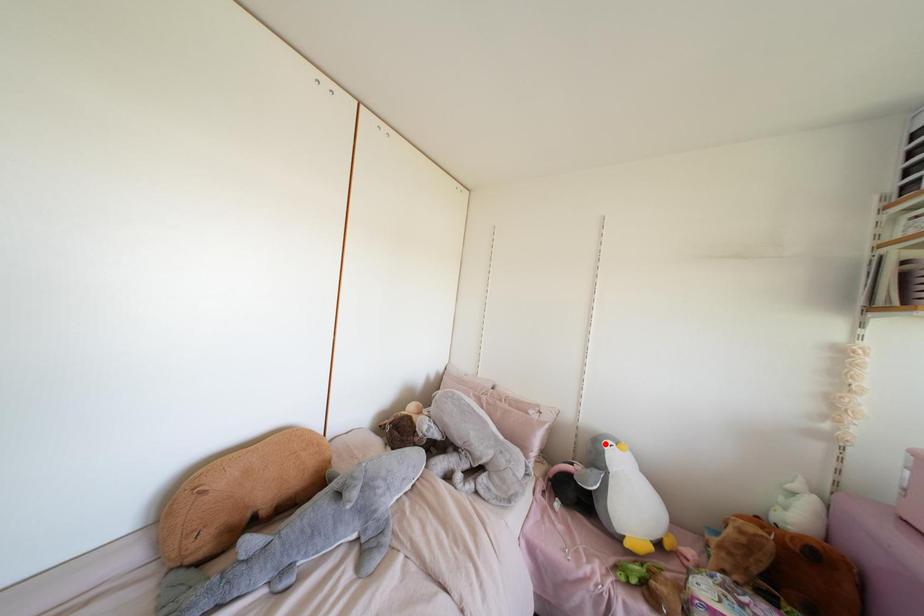
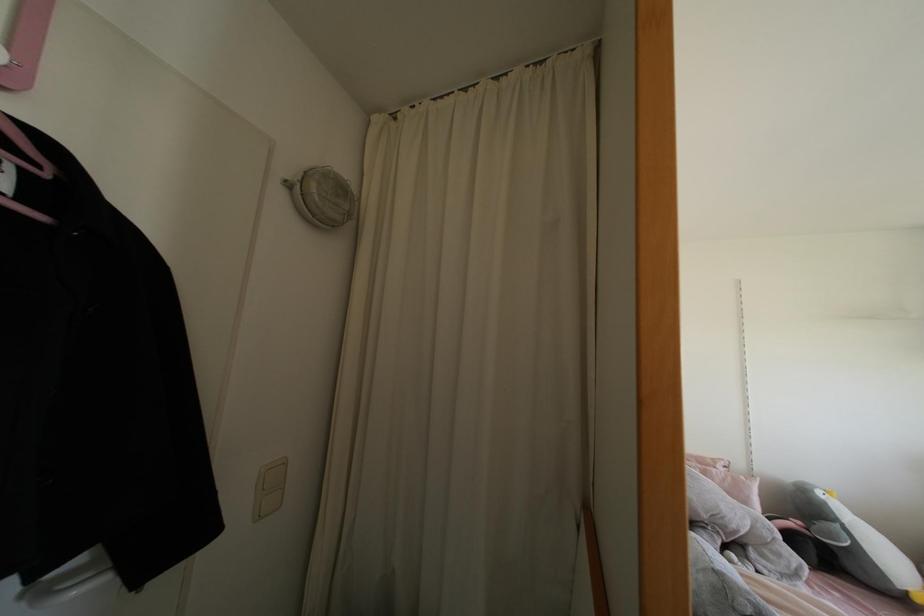
The point at the highlighted location is marked in the first image. Where is the corresponding point in the second image?

(819, 493)